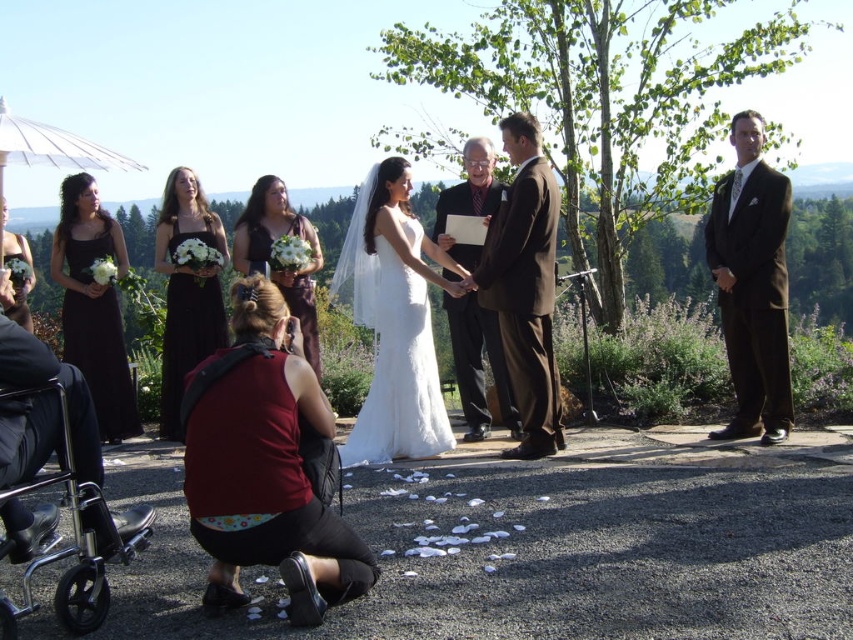
Question: Which point is farther to the camera?

Choices:
 (A) (773, 298)
 (B) (56, 244)
 (C) (74, 492)

Answer: (B)

Question: Does black satin dress at center appear on the left side of matte black dress at lower left?

Choices:
 (A) no
 (B) yes

Answer: (A)

Question: Which object is farther from the camera taking this photo?

Choices:
 (A) black plastic baby carriage at lower left
 (B) white satin dress at center
 (C) red fabric camera at lower center

Answer: (B)

Question: Is brown suit at right positioned at the back of matte purple dress at center?

Choices:
 (A) yes
 (B) no

Answer: (B)

Question: Is brown suit at center below brown textured suit at center?

Choices:
 (A) yes
 (B) no

Answer: (A)

Question: Estimate the real-world distances between objects in this image. Which object is closer to the red fabric camera at lower center?

Choices:
 (A) brown suit at center
 (B) brown suit at right
 (C) matte black dress at lower left

Answer: (A)